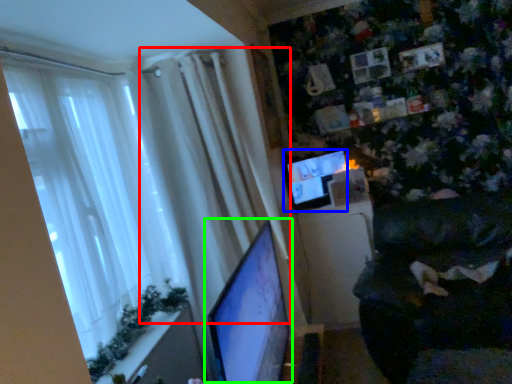
Question: Which object is positioned closest to curtain (highlighted by a red box)? Select from computer monitor (highlighted by a blue box) and computer monitor (highlighted by a green box).

Choices:
 (A) computer monitor
 (B) computer monitor

Answer: (B)